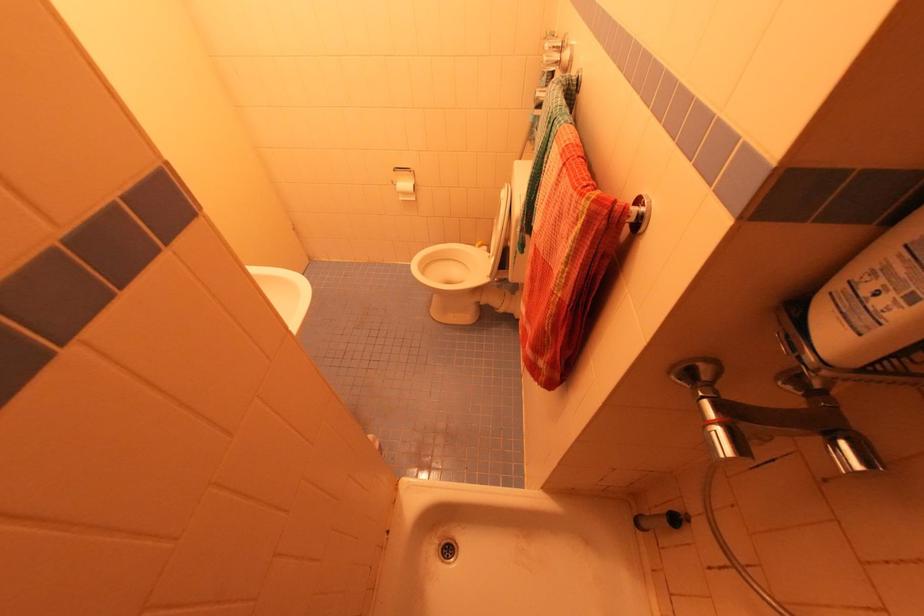
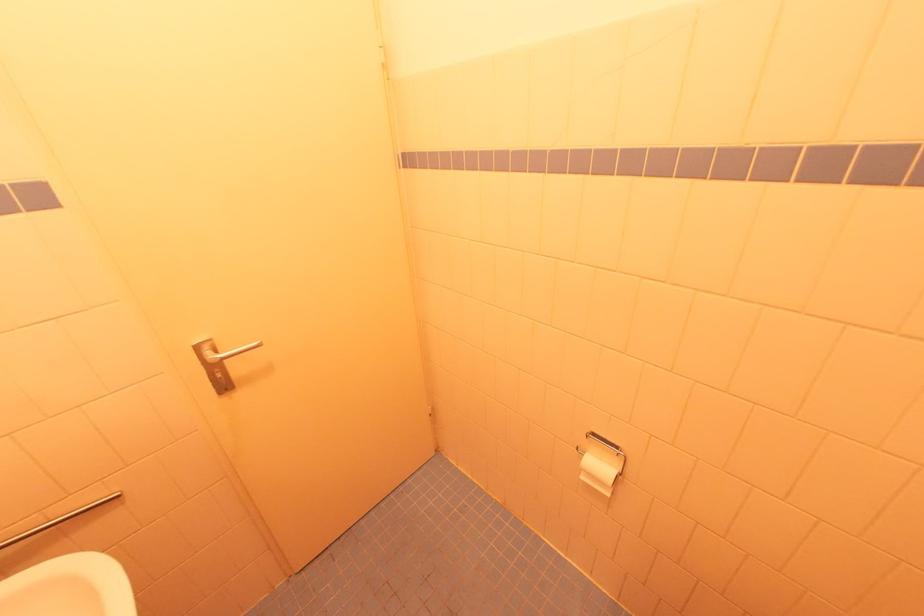
The point at (403,200) is marked in the first image. Where is the corresponding point in the second image?

(585, 479)